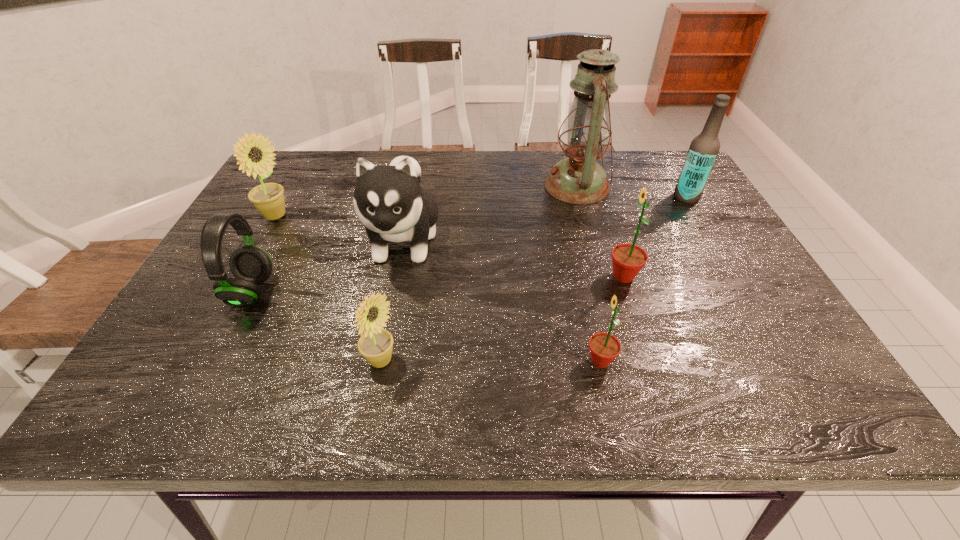
This screenshot has width=960, height=540. What are the coordinates of `free space between the tallest object and the rightmost object` in the screenshot? It's located at (632, 192).

Image resolution: width=960 pixels, height=540 pixels. I want to click on empty space that is in between the left green sunflower and the oil lamp, so click(588, 274).

Where is `free space between the second sunflower from right to left and the third sunflower from right to left`? This screenshot has width=960, height=540. free space between the second sunflower from right to left and the third sunflower from right to left is located at coordinates (491, 361).

You are a GUI agent. You are given a task and a screenshot of the screen. Output one action in this format:
    pyautogui.click(x=<x>, y=<y>)
    Task: Click on the empty location between the headset and the puppy
    The image size is (960, 540).
    Given the screenshot: What is the action you would take?
    pyautogui.click(x=327, y=266)

Image resolution: width=960 pixels, height=540 pixels. Find the location of `free space that is in between the second sunflower from right to left and the tallest object`. free space that is in between the second sunflower from right to left and the tallest object is located at coordinates (588, 274).

Locate an element on the screen. free space between the white puppy and the beer bottle is located at coordinates click(x=545, y=218).

Point out which object is positioned as the third nearest to the left green sunflower. Please provide its 2D coordinates. Your answer should be formatted as a tuple, i.e. [(x, y)], where the tuple contains the x and y coordinates of a point satisfying the conditions above.

[(376, 344)]

Choose which object is the third nearest neighbor to the black headset. Please provide its 2D coordinates. Your answer should be formatted as a tuple, i.e. [(x, y)], where the tuple contains the x and y coordinates of a point satisfying the conditions above.

[(376, 344)]

Identify the location of sunflower that is the second closest to the left green sunflower. The height and width of the screenshot is (540, 960). (376, 344).

Locate which sunflower ranks second in proximity to the rightmost object. Please provide its 2D coordinates. Your answer should be formatted as a tuple, i.e. [(x, y)], where the tuple contains the x and y coordinates of a point satisfying the conditions above.

[(604, 348)]